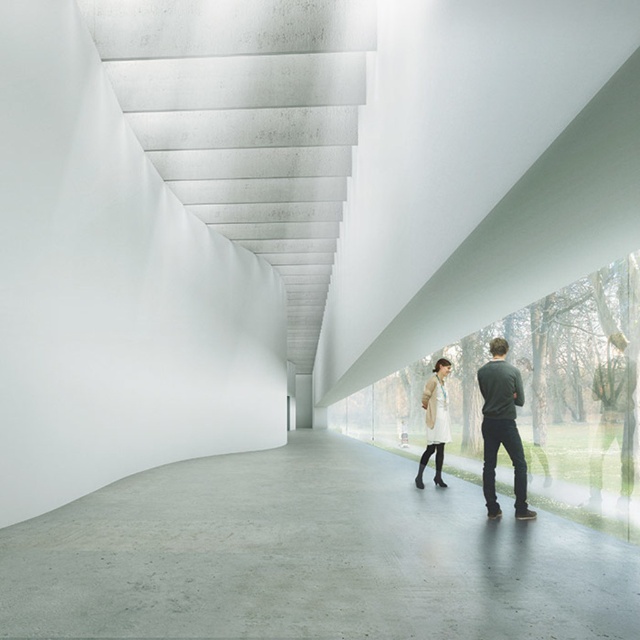
You are a delivery person with a box that is 3 meters long. You are standing at the camera position and want to place the box on the gray polished concrete floor at center. Can you fit the entire box on the floor without any part hanging off?

The gray polished concrete floor at center is 3.29 meters from the camera. Since the box is 3 meters long, it will fit on the floor as the distance from the camera to the floor is greater than the box length.

You are standing in the room and see the gray polished concrete floor at center and the beige wool coat at center. Which object is positioned to the left of the other?

The gray polished concrete floor at center is to the left of the beige wool coat at center.

In the scene shown: You are an interior designer planning to place two garments in the center of the room. The light beige sweater at center and the beige wool coat at center need to be arranged so that the smaller one is placed in front to ensure visibility. Which garment should be positioned in front?

The light beige sweater at center should be placed in front because it is smaller in size compared to the beige wool coat at center, allowing it to be more visible.